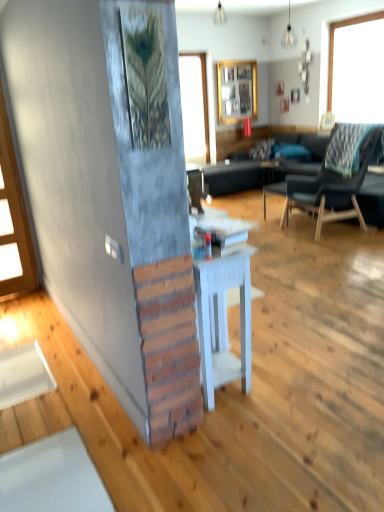
Question: From the image's perspective, would you say matte glass bulb at upper center, acting as the 1th lamp starting from the front, is positioned over clear glass window at upper center?

Choices:
 (A) no
 (B) yes

Answer: (A)

Question: Is matte glass bulb at upper center, the 1th lamp from the right, at the right side of clear glass window at upper center?

Choices:
 (A) yes
 (B) no

Answer: (A)

Question: Are matte glass bulb at upper center, marked as the 2th lamp in a left-to-right arrangement, and clear glass window at upper center making contact?

Choices:
 (A) yes
 (B) no

Answer: (B)

Question: Considering the relative positions of matte glass bulb at upper center, which is counted as the 1th lamp, starting from the bottom, and clear glass window at upper center in the image provided, is matte glass bulb at upper center, which is counted as the 1th lamp, starting from the bottom, to the left of clear glass window at upper center from the viewer's perspective?

Choices:
 (A) no
 (B) yes

Answer: (A)

Question: Considering the relative sizes of matte glass bulb at upper center, acting as the 1th lamp starting from the front, and clear glass window at upper center in the image provided, is matte glass bulb at upper center, acting as the 1th lamp starting from the front, taller than clear glass window at upper center?

Choices:
 (A) yes
 (B) no

Answer: (B)

Question: Would you say matte glass bulb at upper center, which is counted as the 1th lamp, starting from the bottom, is outside clear glass window at upper center?

Choices:
 (A) no
 (B) yes

Answer: (B)

Question: Can you confirm if black fabric couch at center is positioned to the right of wooden frame at upper center?

Choices:
 (A) no
 (B) yes

Answer: (A)

Question: Does black fabric couch at center have a larger size compared to wooden frame at upper center?

Choices:
 (A) yes
 (B) no

Answer: (A)

Question: Considering the relative sizes of black fabric couch at center and wooden frame at upper center in the image provided, is black fabric couch at center shorter than wooden frame at upper center?

Choices:
 (A) yes
 (B) no

Answer: (A)

Question: From a real-world perspective, is black fabric couch at center physically below wooden frame at upper center?

Choices:
 (A) yes
 (B) no

Answer: (A)

Question: Is black fabric couch at center smaller than wooden frame at upper center?

Choices:
 (A) yes
 (B) no

Answer: (B)

Question: Is black fabric couch at center wider than wooden frame at upper center?

Choices:
 (A) no
 (B) yes

Answer: (B)

Question: Considering the relative sizes of white wood side table at center and matte white lampshade at upper center, which is counted as the 1th lamp, starting from the left, in the image provided, is white wood side table at center wider than matte white lampshade at upper center, which is counted as the 1th lamp, starting from the left,?

Choices:
 (A) no
 (B) yes

Answer: (B)